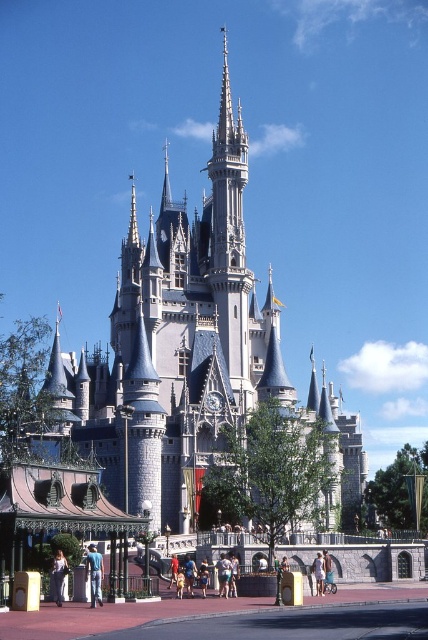
You are a fashion designer observing the scene at the castle. You notice two outfits in the crowd. The denim jeans at lower left and the light brown leather pants at center. Which outfit has a wider leg opening?

The denim jeans at lower left has a wider leg opening than the light brown leather pants at center.

You are a photographer planning to take a photo of the castle. You notice two people wearing denim jeans at lower left and light brown leather pants at center. Which person is closer to the camera?

The denim jeans at lower left is in front of light brown leather pants at center, so the person wearing denim jeans at lower left is closer to the camera.

You are a fashion designer observing the scene at the castle. You notice two outfits at the center of the image. Which of the two, the light brown leather pants at center or the light brown shorts at center, is smaller in size?

The light brown leather pants at center is smaller than the light brown shorts at center.